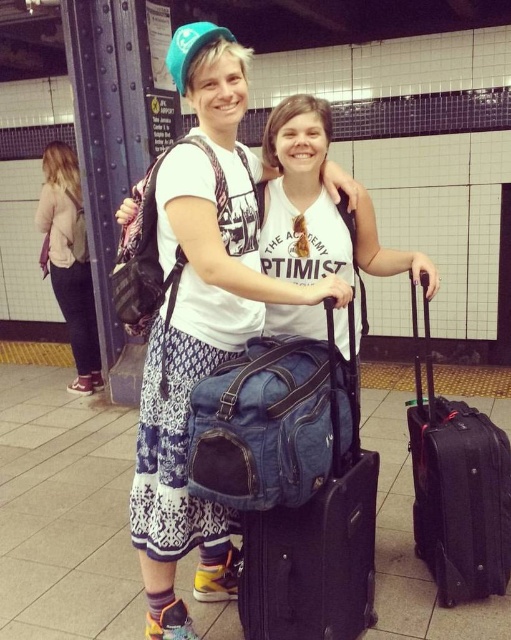
You are a photographer trying to capture a candid shot of two people in a subway station. You notice the white cotton shirt at center and the light pink sweater at left. Which one is positioned to the right of the other?

The white cotton shirt at center is positioned on the right side of light pink sweater at left.

You are a photographer trying to capture a photo of the denim fabric suitcase at center and the light pink sweater at left. Based on their positions, which object should you focus on first to ensure both are in frame?

The light pink sweater at left should be focused on first since the denim fabric suitcase at center is positioned to its right, meaning the sweater is closer to the left edge of the frame. By starting with the sweater, you can adjust the camera to include both objects in the shot.

You are a traveler trying to fit your light pink sweater at left into a storage compartment next to the denim fabric suitcase at center. Based on their sizes, can you tell if the sweater will fit alongside the suitcase?

The denim fabric suitcase at center might be wider than light pink sweater at left, so there is a possibility that the light pink sweater at left may not fit alongside the suitcase if the compartment is narrow. Check the space carefully before placing both items.